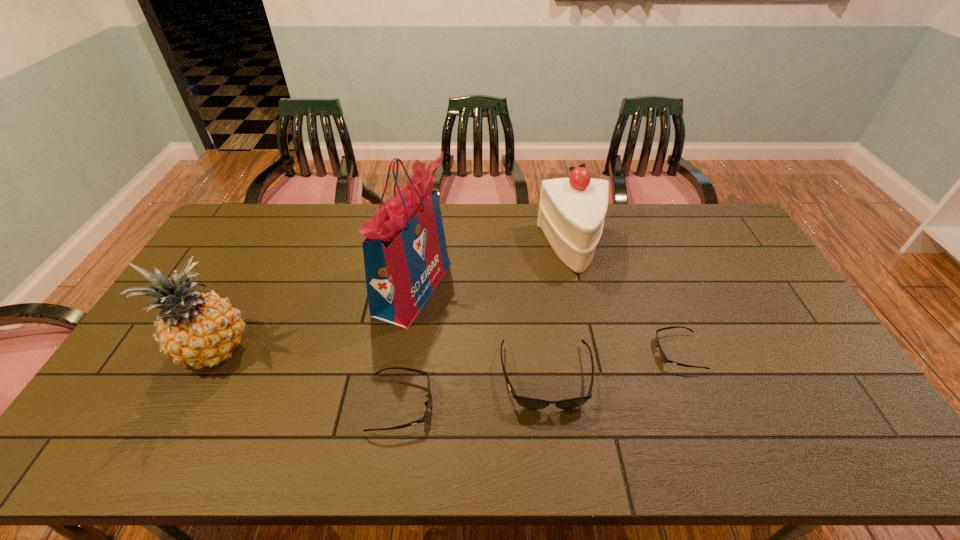
Image resolution: width=960 pixels, height=540 pixels. I want to click on free point located on the front-facing side of the second shortest sunglasses, so click(x=455, y=404).

This screenshot has width=960, height=540. Identify the location of vacant area situated 0.330m on the front-facing side of the rightmost sunglasses. (539, 352).

Locate an element on the screen. The width and height of the screenshot is (960, 540). vacant region located on the front-facing side of the rightmost sunglasses is located at coordinates (638, 352).

The image size is (960, 540). What are the coordinates of `free space located on the front-facing side of the rightmost sunglasses` in the screenshot? It's located at (528, 352).

You are a GUI agent. You are given a task and a screenshot of the screen. Output one action in this format:
    pyautogui.click(x=<x>, y=<y>)
    Task: Click on the vacant space located on the front-facing side of the grocery bag
    Image resolution: width=960 pixels, height=540 pixels.
    Given the screenshot: What is the action you would take?
    pyautogui.click(x=570, y=288)

Where is `free location located 0.260m on the front of the cake`? The image size is (960, 540). free location located 0.260m on the front of the cake is located at coordinates (594, 337).

Where is `vacant area situated on the right of the leftmost object`? This screenshot has height=540, width=960. vacant area situated on the right of the leftmost object is located at coordinates (323, 352).

You are a GUI agent. You are given a task and a screenshot of the screen. Output one action in this format:
    pyautogui.click(x=<x>, y=<y>)
    Task: Click on the object located in the far edge section of the desktop
    
    Given the screenshot: What is the action you would take?
    pyautogui.click(x=571, y=215)

This screenshot has height=540, width=960. I want to click on object located in the left edge section of the desktop, so click(194, 328).

Locate an element on the screen. The height and width of the screenshot is (540, 960). vacant space at the far edge of the desktop is located at coordinates (506, 222).